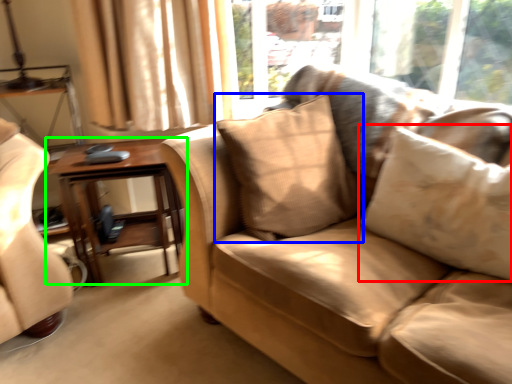
Question: Which is farther away from pillow (highlighted by a red box)? pillow (highlighted by a blue box) or table (highlighted by a green box)?

Choices:
 (A) pillow
 (B) table

Answer: (B)